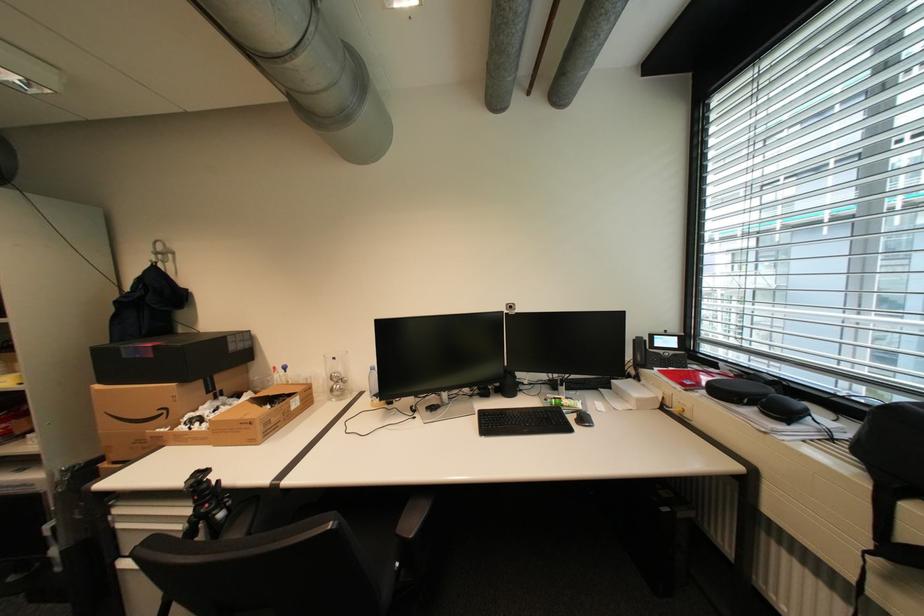
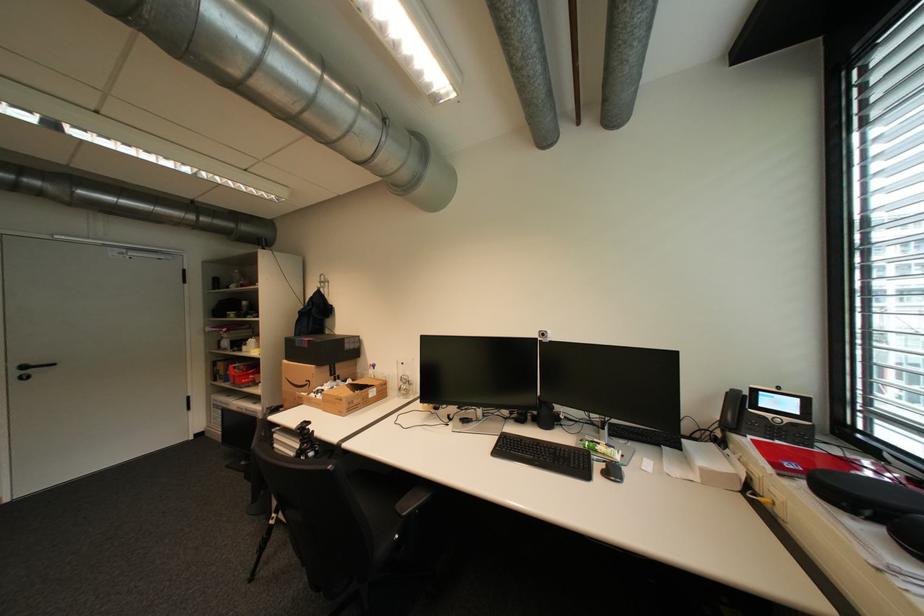
Locate, in the second image, the point that corresponds to (x=695, y=383) in the first image.

(796, 466)